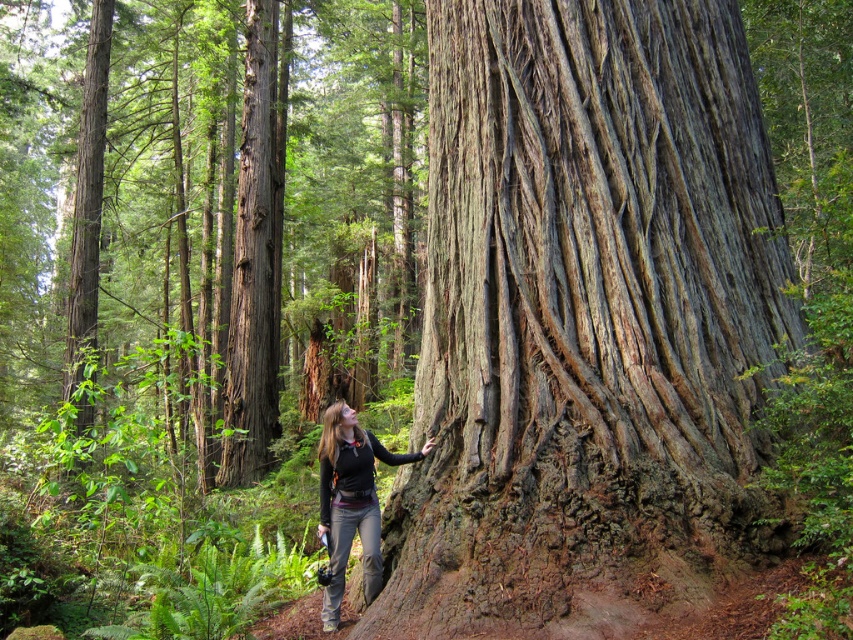
Is rough bark tree trunk at center positioned in front of smooth brown bark at center?

Yes, rough bark tree trunk at center is in front of smooth brown bark at center.

Is rough bark tree trunk at center shorter than smooth brown bark at center?

Yes.

Locate an element on the screen. This screenshot has width=853, height=640. rough bark tree trunk at center is located at coordinates (589, 323).

Where is `rough bark tree trunk at center`? Image resolution: width=853 pixels, height=640 pixels. rough bark tree trunk at center is located at coordinates (589, 323).

Is smooth brown bark at center thinner than matte black jacket at center?

In fact, smooth brown bark at center might be wider than matte black jacket at center.

Does point (250, 116) come farther from viewer compared to point (334, 604)?

Yes.

Locate an element on the screen. This screenshot has width=853, height=640. smooth brown bark at center is located at coordinates (256, 253).

You are a GUI agent. You are given a task and a screenshot of the screen. Output one action in this format:
    pyautogui.click(x=<x>, y=<y>)
    Task: Click on the smooth brown bark at center
    The width and height of the screenshot is (853, 640).
    Given the screenshot: What is the action you would take?
    pyautogui.click(x=256, y=253)

In the scene shown: Is rough bark tree trunk at center to the right of matte black jacket at center from the viewer's perspective?

Yes, rough bark tree trunk at center is to the right of matte black jacket at center.

The width and height of the screenshot is (853, 640). I want to click on rough bark tree trunk at center, so click(x=589, y=323).

Find the location of `rough bark tree trunk at center`. rough bark tree trunk at center is located at coordinates (589, 323).